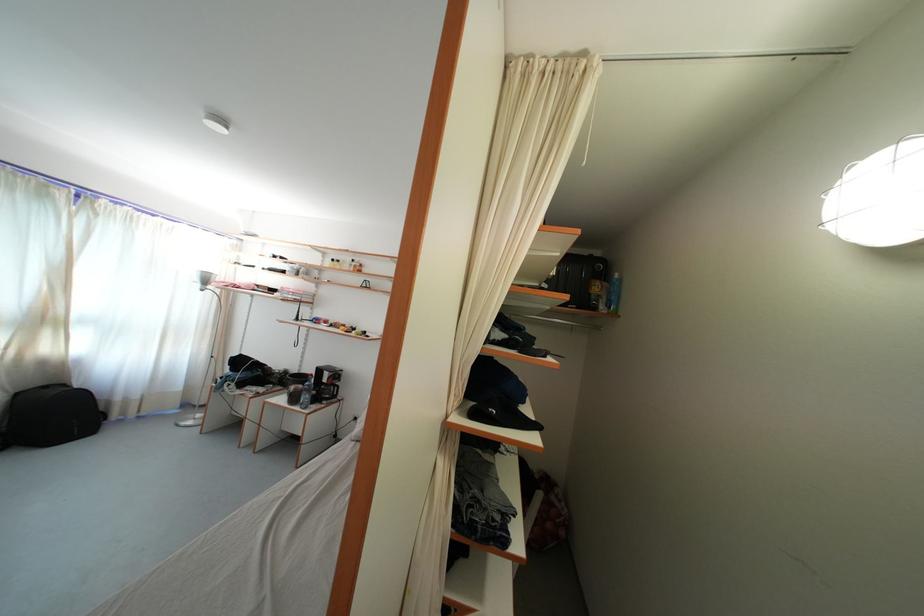
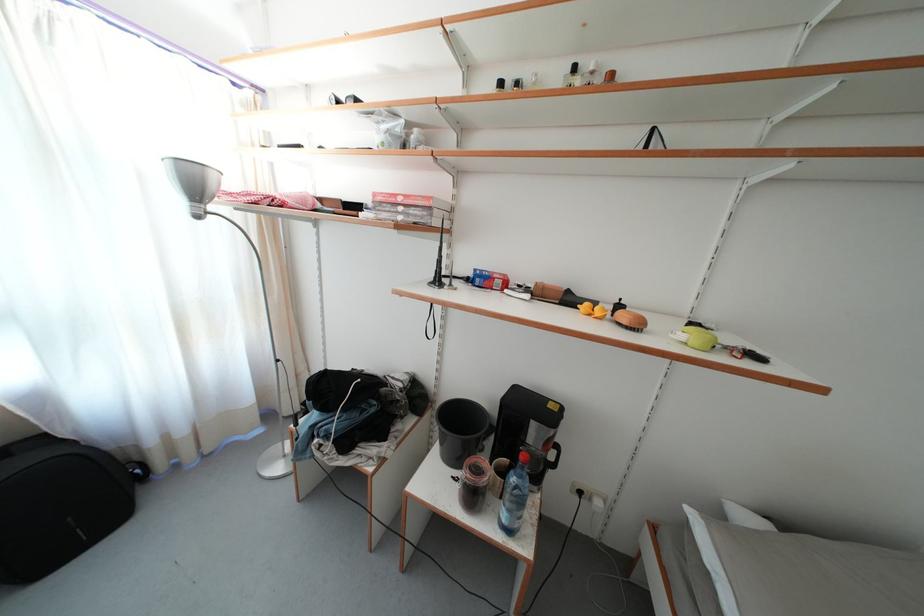
What movement of the cameraman would produce the second image?

The movement direction of the cameraman is left, forward.